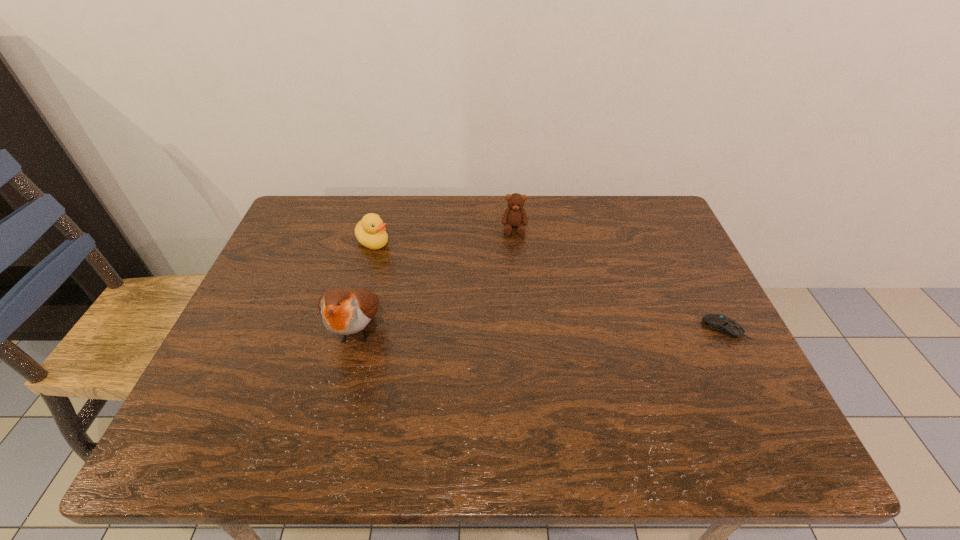
Where is `bird`? bird is located at coordinates (344, 311).

Where is `the rightmost object`? This screenshot has width=960, height=540. the rightmost object is located at coordinates (719, 323).

At what (x,y) coordinates should I click in order to perform the action: click on the shortest object. Please return your answer as a coordinate pair (x, y). Looking at the image, I should click on (719, 323).

You are a GUI agent. You are given a task and a screenshot of the screen. Output one action in this format:
    pyautogui.click(x=<x>, y=<y>)
    Task: Click on the duckling
    
    Given the screenshot: What is the action you would take?
    pyautogui.click(x=370, y=231)

Locate an element on the screen. The image size is (960, 540). teddy bear is located at coordinates (515, 216).

This screenshot has height=540, width=960. Find the location of `free space located 0.100m on the front of the rightmost object`. free space located 0.100m on the front of the rightmost object is located at coordinates (750, 378).

The height and width of the screenshot is (540, 960). In order to click on free space located 0.390m on the face of the duckling in this screenshot , I will do `click(488, 318)`.

This screenshot has width=960, height=540. In order to click on vacant space located 0.120m on the face of the duckling in this screenshot , I will do `click(414, 268)`.

Find the location of a particular element. free space located 0.150m on the face of the duckling is located at coordinates (421, 273).

The height and width of the screenshot is (540, 960). In order to click on vacant area situated on the face of the teddy bear in this screenshot , I will do `click(515, 260)`.